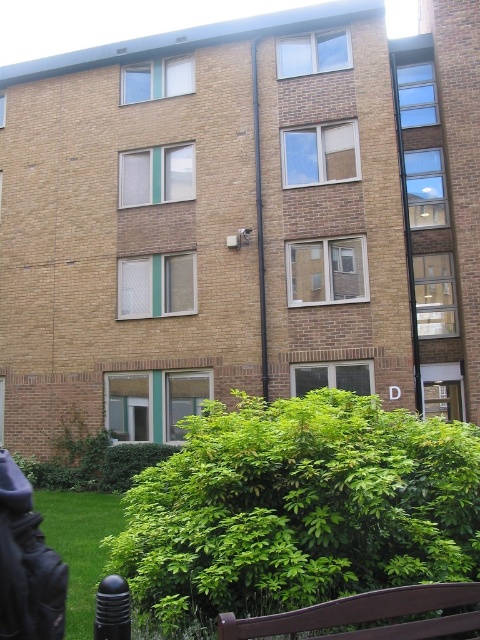
Question: Which of the following is the farthest from the observer?

Choices:
 (A) (441, 452)
 (B) (479, 621)

Answer: (A)

Question: Can you confirm if green leafy bush at center is smaller than brown wooden bench at lower center?

Choices:
 (A) yes
 (B) no

Answer: (B)

Question: Which of the following is the closest to the observer?

Choices:
 (A) (238, 628)
 (B) (164, 588)

Answer: (A)

Question: In this image, where is green leafy bush at center located relative to brown wooden bench at lower center?

Choices:
 (A) right
 (B) left

Answer: (B)

Question: Considering the relative positions of green leafy bush at center and brown wooden bench at lower center in the image provided, where is green leafy bush at center located with respect to brown wooden bench at lower center?

Choices:
 (A) left
 (B) right

Answer: (A)